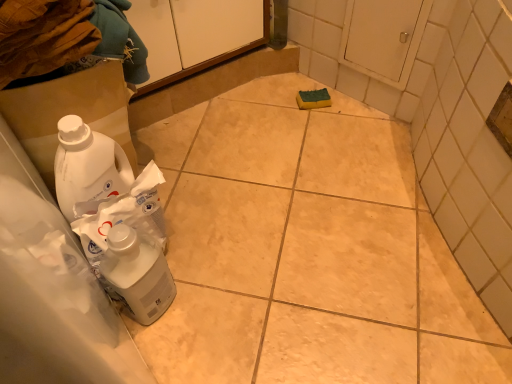
Question: Considering the relative sizes of white glossy plastic bottle at lower left and white matte cabinet at upper center in the image provided, is white glossy plastic bottle at lower left smaller than white matte cabinet at upper center?

Choices:
 (A) yes
 (B) no

Answer: (A)

Question: Does white glossy plastic bottle at lower left have a larger size compared to white matte cabinet at upper center?

Choices:
 (A) no
 (B) yes

Answer: (A)

Question: Is white glossy plastic bottle at lower left looking in the opposite direction of white matte cabinet at upper center?

Choices:
 (A) no
 (B) yes

Answer: (A)

Question: Is white glossy plastic bottle at lower left completely or partially outside of white matte cabinet at upper center?

Choices:
 (A) yes
 (B) no

Answer: (A)

Question: Does white glossy plastic bottle at lower left touch white matte cabinet at upper center?

Choices:
 (A) no
 (B) yes

Answer: (A)

Question: From a real-world perspective, is white cardboard box at lower left physically located above or below white matte cabinet at upper center?

Choices:
 (A) above
 (B) below

Answer: (B)

Question: From the image's perspective, is white cardboard box at lower left above or below white matte cabinet at upper center?

Choices:
 (A) above
 (B) below

Answer: (B)

Question: In terms of width, does white cardboard box at lower left look wider or thinner when compared to white matte cabinet at upper center?

Choices:
 (A) thin
 (B) wide

Answer: (A)

Question: Visually, is white cardboard box at lower left positioned to the left or to the right of white matte cabinet at upper center?

Choices:
 (A) left
 (B) right

Answer: (A)

Question: Is white glossy plastic bottle at lower left taller or shorter than white matte cabinet at upper center?

Choices:
 (A) short
 (B) tall

Answer: (B)

Question: Is white glossy plastic bottle at lower left wider or thinner than white matte cabinet at upper center?

Choices:
 (A) thin
 (B) wide

Answer: (A)

Question: Looking at the image, does white glossy plastic bottle at lower left seem bigger or smaller compared to white matte cabinet at upper center?

Choices:
 (A) small
 (B) big

Answer: (A)

Question: Is white glossy plastic bottle at lower left spatially inside white matte cabinet at upper center, or outside of it?

Choices:
 (A) inside
 (B) outside

Answer: (B)

Question: Based on their positions, is white matte cabinet at upper center located to the left or right of white glossy plastic bottle at lower left?

Choices:
 (A) right
 (B) left

Answer: (B)

Question: Do you think white matte cabinet at upper center is within white glossy plastic bottle at lower left, or outside of it?

Choices:
 (A) inside
 (B) outside

Answer: (B)